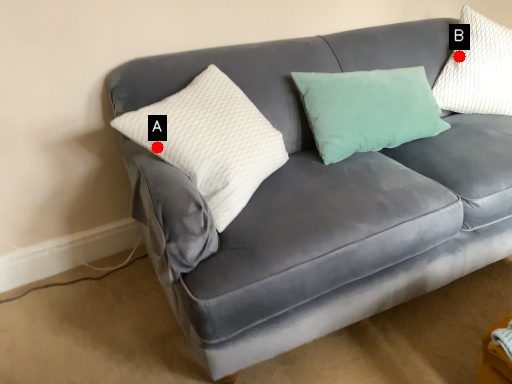
Question: Two points are circled on the image, labeled by A and B beside each circle. Which point is farther from the camera taking this photo?

Choices:
 (A) A is further
 (B) B is further

Answer: (B)